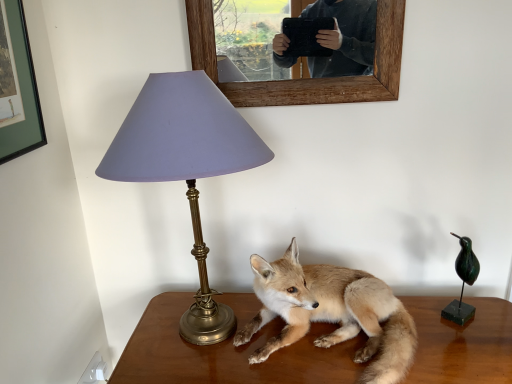
Measure the distance between point (447, 341) and camera.

They are 3.47 feet apart.

Image resolution: width=512 pixels, height=384 pixels. In order to click on matte purple shade at left in this screenshot , I will do `click(186, 166)`.

In order to click on furry golden fox at center in this screenshot , I will do `click(331, 312)`.

Looking at this image, from a real-world perspective, who is located higher, furry golden fox at center or matte purple shade at left?

In real-world perspective, matte purple shade at left is above.

Is matte purple shade at left completely or partially inside furry golden fox at center?

No, furry golden fox at center does not contain matte purple shade at left.

From the image's perspective, does furry golden fox at center appear lower than matte purple shade at left?

Indeed, from the image's perspective, furry golden fox at center is shown beneath matte purple shade at left.

From the picture: Which of these two, furry golden fox at center or matte purple shade at left, is smaller?

furry golden fox at center.

Considering the relative sizes of furry golden fox at center and brown wooden table at center in the image provided, is furry golden fox at center bigger than brown wooden table at center?

Incorrect, furry golden fox at center is not larger than brown wooden table at center.

Which of these two, furry golden fox at center or brown wooden table at center, stands shorter?

Standing shorter between the two is furry golden fox at center.

Is furry golden fox at center aimed at brown wooden table at center?

No, furry golden fox at center does not turn towards brown wooden table at center.

From the image's perspective, is furry golden fox at center on brown wooden table at center?

Yes, from the image's perspective, furry golden fox at center is over brown wooden table at center.

Considering the relative positions of matte purple shade at left and wooden picture frame at upper center in the image provided, is matte purple shade at left behind wooden picture frame at upper center?

That is False.

From their relative heights in the image, would you say matte purple shade at left is taller or shorter than wooden picture frame at upper center?

In the image, matte purple shade at left appears to be taller than wooden picture frame at upper center.

Consider the image. Does matte purple shade at left have a smaller size compared to wooden picture frame at upper center?

No, matte purple shade at left is not smaller than wooden picture frame at upper center.

Which object is further away from the camera, matte purple shade at left or brown wooden table at center?

Positioned behind is brown wooden table at center.

Can you confirm if matte purple shade at left is taller than brown wooden table at center?

Indeed, matte purple shade at left has a greater height compared to brown wooden table at center.

Which is more to the left, matte purple shade at left or brown wooden table at center?

From the viewer's perspective, matte purple shade at left appears more on the left side.

Does point (225, 170) come behind point (200, 372)?

No, (225, 170) is in front of (200, 372).

Does brown wooden table at center come behind matte purple shade at left?

Yes, brown wooden table at center is further from the viewer.

Can we say brown wooden table at center lies outside matte purple shade at left?

brown wooden table at center lies outside matte purple shade at left's area.

Is brown wooden table at center with matte purple shade at left?

No, brown wooden table at center is not touching matte purple shade at left.

In terms of size, does brown wooden table at center appear bigger or smaller than matte purple shade at left?

Clearly, brown wooden table at center is larger in size than matte purple shade at left.

Are matte purple shade at left and furry golden fox at center beside each other?

No, matte purple shade at left is not in contact with furry golden fox at center.

How different are the orientations of matte purple shade at left and furry golden fox at center in degrees?

matte purple shade at left and furry golden fox at center are facing 5.88 degrees away from each other.

Considering their positions, is matte purple shade at left located in front of or behind furry golden fox at center?

matte purple shade at left is in front of furry golden fox at center.

Between matte purple shade at left and furry golden fox at center, which one has less height?

furry golden fox at center is shorter.

Who is more distant, brown wooden table at center or furry golden fox at center?

brown wooden table at center.

Does brown wooden table at center have a greater width compared to furry golden fox at center?

Yes.

Could you tell me if brown wooden table at center is facing furry golden fox at center?

No, brown wooden table at center is not facing towards furry golden fox at center.

Is brown wooden table at center not near furry golden fox at center?

No, brown wooden table at center is not far from furry golden fox at center.

Image resolution: width=512 pixels, height=384 pixels. I want to click on lamp on the left of the furry golden fox at center, so click(x=186, y=166).

The height and width of the screenshot is (384, 512). In order to click on table lying on the right of furry golden fox at center in this screenshot , I will do point(228,353).

Which object lies further to the anchor point matte purple shade at left, furry golden fox at center or brown wooden table at center?

Based on the image, brown wooden table at center appears to be further to matte purple shade at left.

In the scene shown: Considering their positions, is matte purple shade at left positioned further to wooden picture frame at upper center than brown wooden table at center?

brown wooden table at center is positioned further to the anchor wooden picture frame at upper center.

Which object lies further to the anchor point matte purple shade at left, furry golden fox at center or wooden picture frame at upper center?

The object further to matte purple shade at left is wooden picture frame at upper center.

Considering their positions, is brown wooden table at center positioned further to matte purple shade at left than furry golden fox at center?

The object further to matte purple shade at left is brown wooden table at center.

When comparing their distances from wooden picture frame at upper center, does brown wooden table at center or matte purple shade at left seem closer?

matte purple shade at left lies closer to wooden picture frame at upper center than the other object.

Based on their spatial positions, is brown wooden table at center or wooden picture frame at upper center closer to furry golden fox at center?

brown wooden table at center.

Consider the image. When comparing their distances from wooden picture frame at upper center, does brown wooden table at center or furry golden fox at center seem further?

Based on the image, brown wooden table at center appears to be further to wooden picture frame at upper center.

From the image, which object appears to be farther from wooden picture frame at upper center, matte purple shade at left or furry golden fox at center?

furry golden fox at center lies further to wooden picture frame at upper center than the other object.

Locate an element on the screen. This screenshot has width=512, height=384. lamp between wooden picture frame at upper center and furry golden fox at center vertically is located at coordinates (186, 166).

The image size is (512, 384). In order to click on fox between matte purple shade at left and brown wooden table at center vertically in this screenshot , I will do `click(331, 312)`.

This screenshot has width=512, height=384. I want to click on fox between wooden picture frame at upper center and brown wooden table at center vertically, so click(331, 312).

The width and height of the screenshot is (512, 384). I want to click on lamp that lies between wooden picture frame at upper center and brown wooden table at center from top to bottom, so click(186, 166).